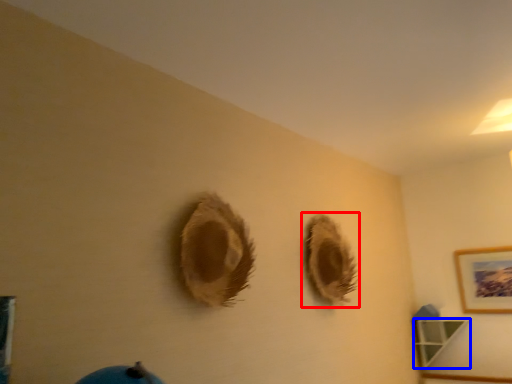
Question: Which object appears closest to the camera in this image, hole (highlighted by a red box) or shelf (highlighted by a blue box)?

Choices:
 (A) hole
 (B) shelf

Answer: (A)